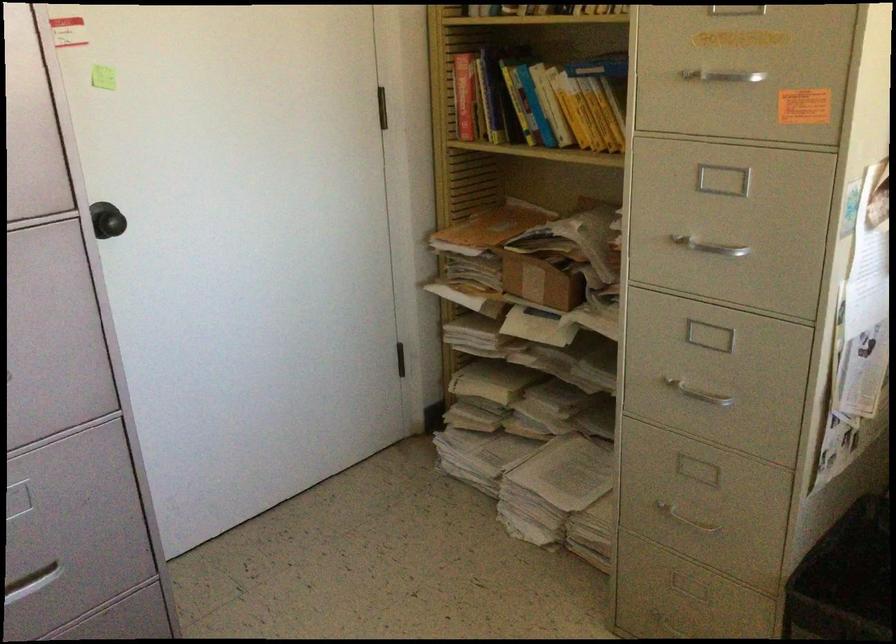
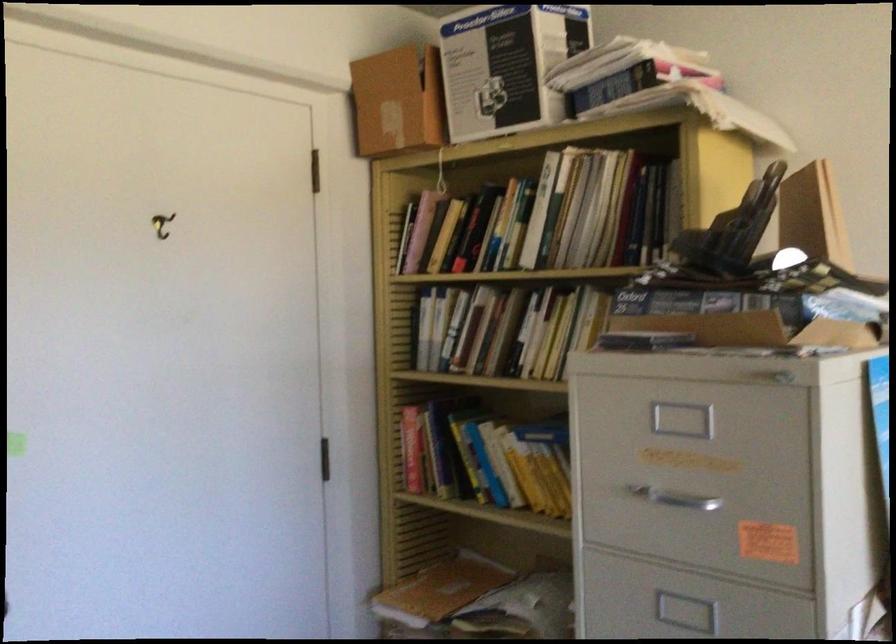
Which direction would the cameraman need to move to produce the second image?

The movement direction of the cameraman is right, forward.